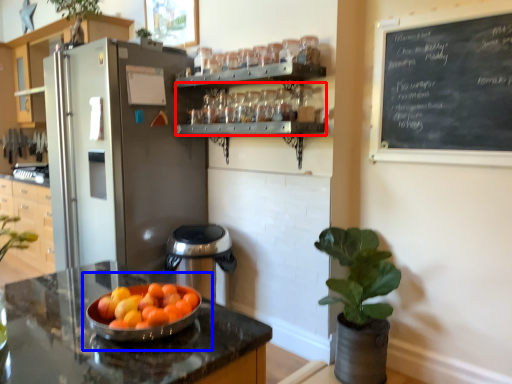
Question: Which object is further to the camera taking this photo, shelf (highlighted by a red box) or fruit dish (highlighted by a blue box)?

Choices:
 (A) shelf
 (B) fruit dish

Answer: (A)